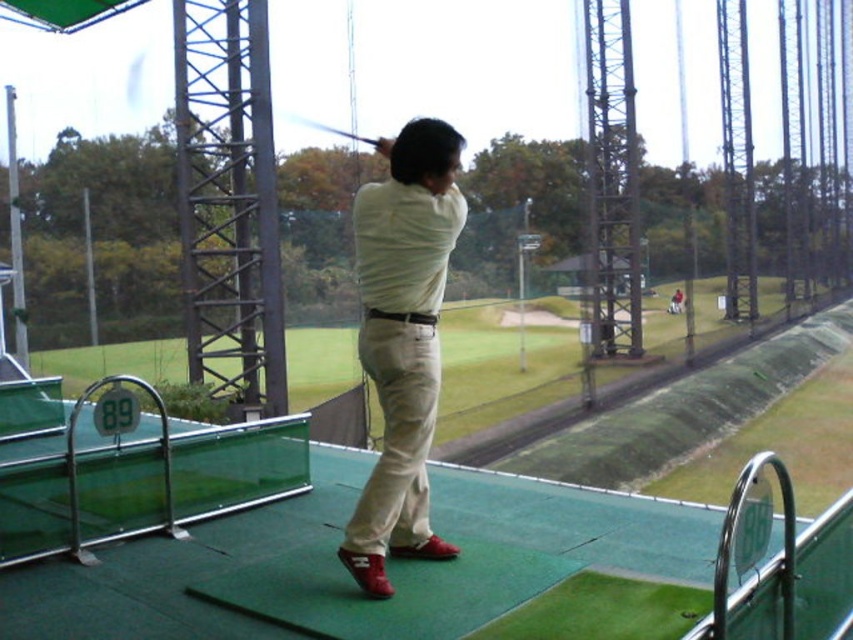
Question: Which point is closer to the camera?

Choices:
 (A) (432, 472)
 (B) (325, 129)

Answer: (A)

Question: Does green rubber mat at center come in front of matte white shirt at center?

Choices:
 (A) yes
 (B) no

Answer: (A)

Question: Can you confirm if green rubber mat at center is smaller than matte white shirt at center?

Choices:
 (A) yes
 (B) no

Answer: (B)

Question: Is green rubber mat at center wider than shiny black golf club at center?

Choices:
 (A) no
 (B) yes

Answer: (B)

Question: Which point is closer to the camera taking this photo?

Choices:
 (A) (328, 129)
 (B) (436, 515)

Answer: (B)

Question: Which of these objects is positioned closest to the green rubber mat at center?

Choices:
 (A) shiny black golf club at center
 (B) matte white shirt at center

Answer: (B)